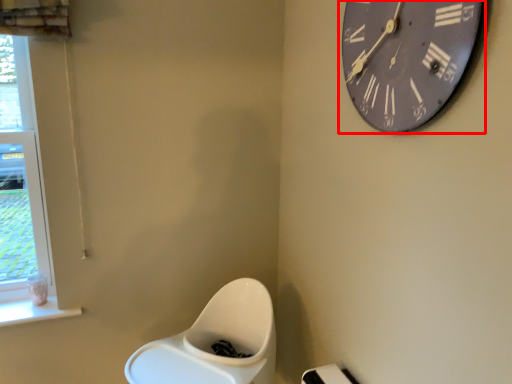
Question: From the image, what is the correct spatial relationship of wall clock (annotated by the red box) in relation to window?

Choices:
 (A) left
 (B) right

Answer: (B)